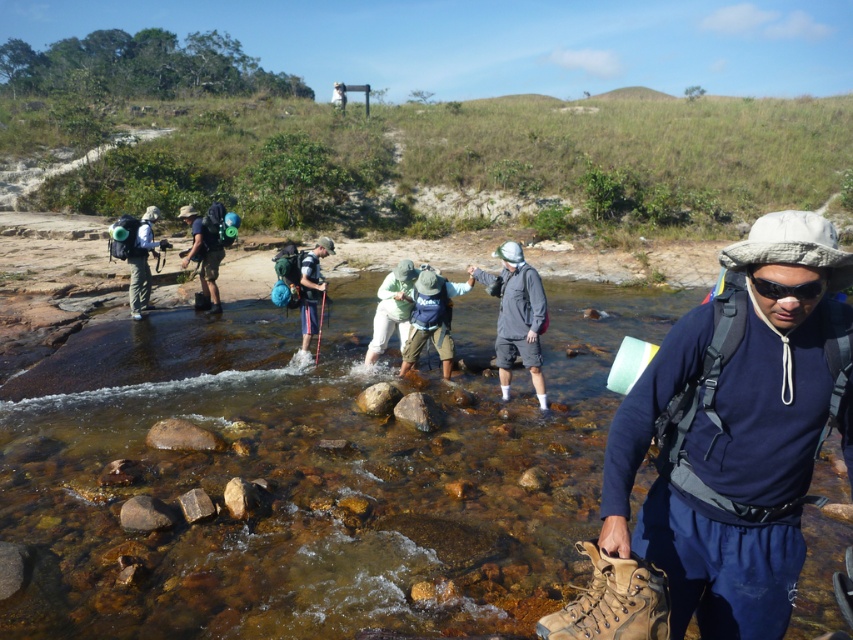
You are a hiker planning to carry both the matte green backpack at left and the light green fabric jacket at center. Since you have limited space, which item should you prioritize packing first based on their sizes?

The matte green backpack at left is larger in size than the light green fabric jacket at center, so you should prioritize packing the matte green backpack at left first to ensure it fits properly in your available space.

You are a hiker planning to cross the stream shown in the scene. You see the clear water at center and the light green fabric jacket at center. Which object takes up more space in the image?

The clear water at center is bigger than the light green fabric jacket at center, so the clear water at center takes up more space in the image.

You are a hiker who wants to locate the light green fabric jacket at center. According to the coordinates provided, where would you look in the image?

The light green fabric jacket at center is located at the coordinates point [392,308].